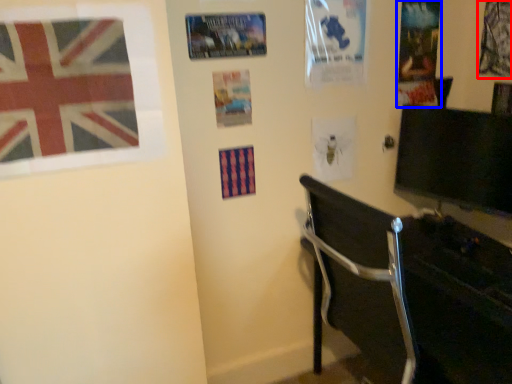
Question: Which object is further to the camera taking this photo, poster page (highlighted by a red box) or poster page (highlighted by a blue box)?

Choices:
 (A) poster page
 (B) poster page

Answer: (B)